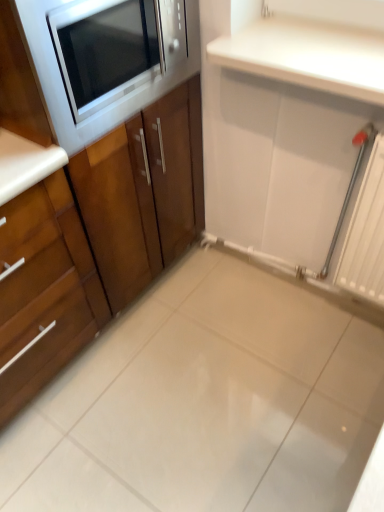
Find the location of a particular element. free space above white glossy countertop at upper right (from a real-world perspective) is located at coordinates (314, 49).